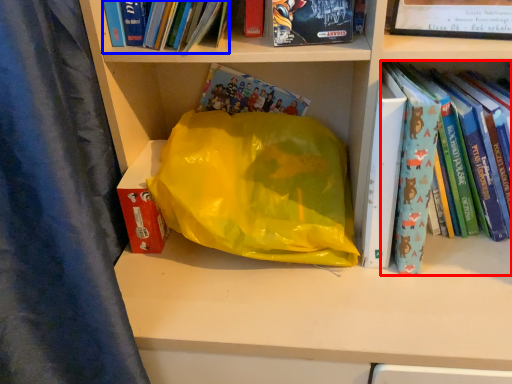
Question: Among these objects, which one is farthest to the camera, book (highlighted by a red box) or book (highlighted by a blue box)?

Choices:
 (A) book
 (B) book

Answer: (A)